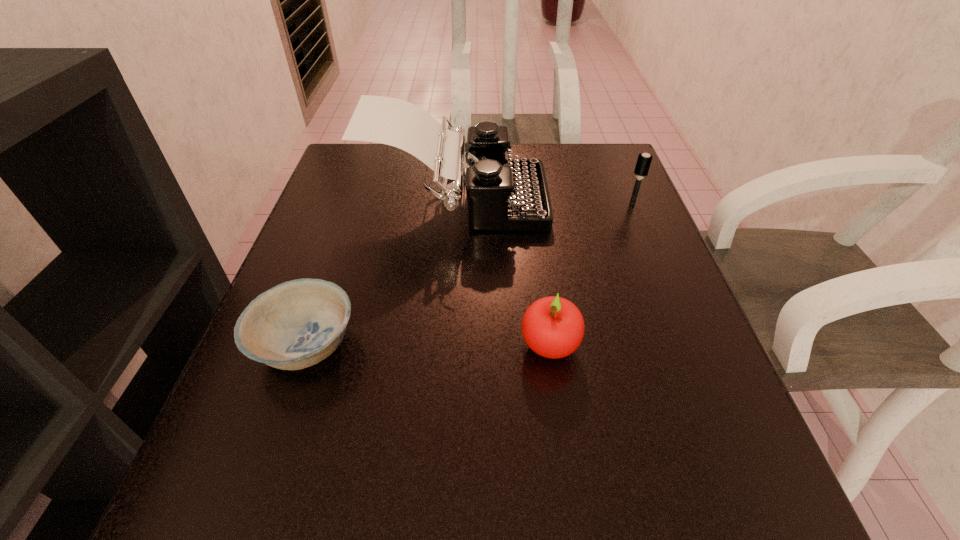
Identify which object is the closest to the shortest object. Please provide its 2D coordinates. Your answer should be formatted as a tuple, i.e. [(x, y)], where the tuple contains the x and y coordinates of a point satisfying the conditions above.

[(503, 194)]

Identify the location of free region that satisfies the following two spatial constraints: 1. on the front side of the apple; 2. on the right side of the bowl. (305, 345).

You are a GUI agent. You are given a task and a screenshot of the screen. Output one action in this format:
    pyautogui.click(x=<x>, y=<y>)
    Task: Click on the free region that satisfies the following two spatial constraints: 1. on the front side of the apple; 2. on the left side of the bowl
    Image resolution: width=960 pixels, height=540 pixels.
    Given the screenshot: What is the action you would take?
    pyautogui.click(x=305, y=345)

At what (x,y) coordinates should I click in order to perform the action: click on free space that satisfies the following two spatial constraints: 1. on the keys of the tallest object; 2. on the back side of the apple. Please return your answer as a coordinate pair (x, y). Looking at the image, I should click on (450, 345).

The image size is (960, 540). In order to click on vacant space that satisfies the following two spatial constraints: 1. on the keys of the rightmost object; 2. on the right side of the typewriter in this screenshot , I will do `click(458, 202)`.

Where is `vacant region that satisfies the following two spatial constraints: 1. on the back side of the bowl; 2. on the left side of the rightmost object`? This screenshot has height=540, width=960. vacant region that satisfies the following two spatial constraints: 1. on the back side of the bowl; 2. on the left side of the rightmost object is located at coordinates (354, 202).

The width and height of the screenshot is (960, 540). I want to click on vacant space that satisfies the following two spatial constraints: 1. on the front side of the apple; 2. on the left side of the shortest object, so click(305, 345).

The image size is (960, 540). In order to click on free space that satisfies the following two spatial constraints: 1. on the keys of the tallest object; 2. on the back side of the rightmost object in this screenshot , I will do `click(458, 202)`.

What are the coordinates of `vacant position in the image that satisfies the following two spatial constraints: 1. on the keys of the tallest object; 2. on the front side of the bowl` in the screenshot? It's located at (450, 343).